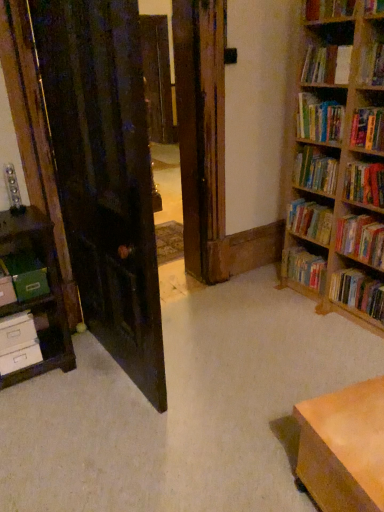
At what (x,y) coordinates should I click in order to perform the action: click on free spot below hardcover book at right, arranged as the ninth book when viewed from the top (from a real-world perspective). Please return your answer as a coordinate pair (x, y). Looking at the image, I should click on (356, 321).